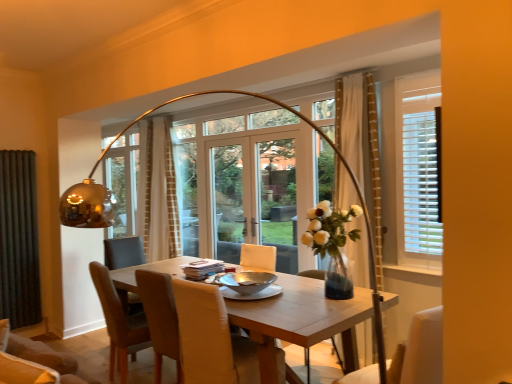
Question: Is light brown wooden table at center to the left or to the right of brown leather chair at center, which appears as the 3th chair when viewed from the right, in the image?

Choices:
 (A) right
 (B) left

Answer: (A)

Question: From their relative heights in the image, would you say light brown wooden table at center is taller or shorter than brown leather chair at center, acting as the first chair starting from the left?

Choices:
 (A) short
 (B) tall

Answer: (A)

Question: Which is farther from the light brown wooden table at center?

Choices:
 (A) black fabric curtain at left, which is counted as the 2th curtain, starting from the back
 (B) white fabric chair at lower right, the 1th chair when ordered from front to back
 (C) leather at center, acting as the second chair starting from the left
 (D) brown leather chair at center, acting as the first chair starting from the back
 (E) beige textured curtain at center, which is the 2th curtain in right-to-left order

Answer: (A)

Question: Which of these objects is positioned closest to the white fabric chair at lower right, which is the third chair in back-to-front order?

Choices:
 (A) beige textured curtain at center, the 3th curtain viewed from the front
 (B) clear glass door at center
 (C) black fabric curtain at left, which is counted as the 2th curtain, starting from the back
 (D) light brown wooden table at center
 (E) leather at center, which is the 2th chair from back to front

Answer: (D)